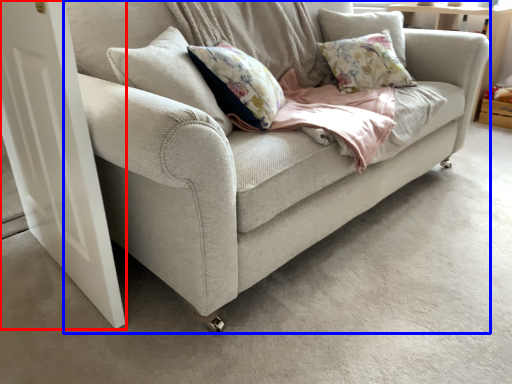
Question: Among these objects, which one is nearest to the camera, screen door (highlighted by a red box) or studio couch (highlighted by a blue box)?

Choices:
 (A) screen door
 (B) studio couch

Answer: (B)